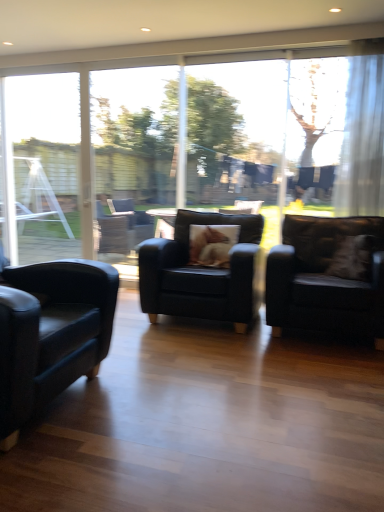
In order to click on vacant area that is in front of matte black armchair at right, which is the 3th chair from left to right in this screenshot , I will do `click(315, 372)`.